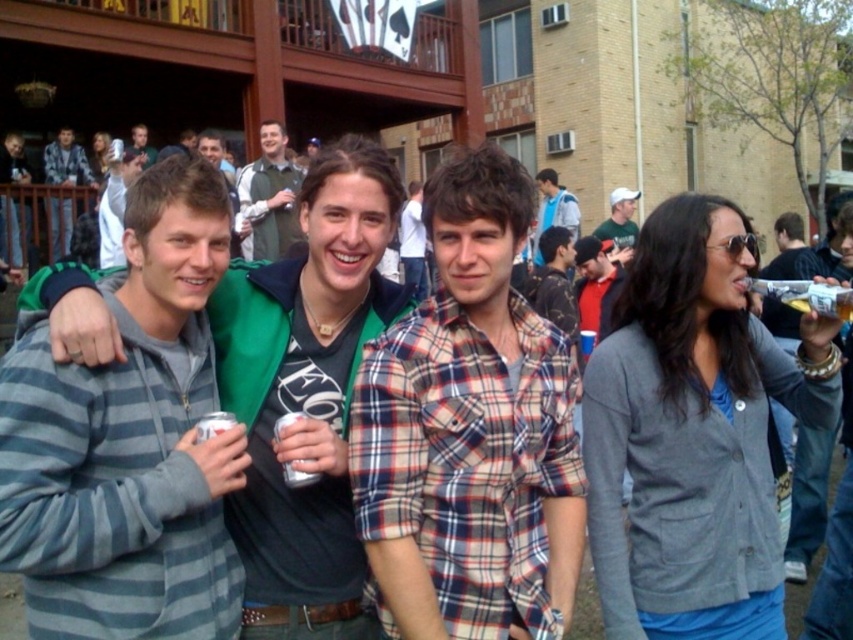
Between matte black jacket at upper left and matte black shirt at upper left, which one is positioned higher?

matte black shirt at upper left is above.

Is point (54, 140) closer to camera compared to point (138, 124)?

Yes, point (54, 140) is in front of point (138, 124).

You are a GUI agent. You are given a task and a screenshot of the screen. Output one action in this format:
    pyautogui.click(x=<x>, y=<y>)
    Task: Click on the matte black jacket at upper left
    Image resolution: width=853 pixels, height=640 pixels.
    Given the screenshot: What is the action you would take?
    pyautogui.click(x=67, y=161)

Which is above, green fabric vest at upper center or matte black jacket at upper left?

matte black jacket at upper left

Is point (241, 198) closer to viewer compared to point (70, 228)?

No, it is not.

Measure the distance between green fabric vest at upper center and camera.

They are 90.79 feet apart.

The height and width of the screenshot is (640, 853). Find the location of `green fabric vest at upper center`. green fabric vest at upper center is located at coordinates (270, 195).

Can you confirm if plaid shirt at center is shorter than matte black shirt at upper left?

No, plaid shirt at center is not shorter than matte black shirt at upper left.

Where is `plaid shirt at center`? The height and width of the screenshot is (640, 853). plaid shirt at center is located at coordinates coord(554,209).

Image resolution: width=853 pixels, height=640 pixels. In order to click on plaid shirt at center in this screenshot , I will do `click(554, 209)`.

You are a GUI agent. You are given a task and a screenshot of the screen. Output one action in this format:
    pyautogui.click(x=<x>, y=<y>)
    Task: Click on the plaid shirt at center
    The width and height of the screenshot is (853, 640).
    Given the screenshot: What is the action you would take?
    pyautogui.click(x=554, y=209)